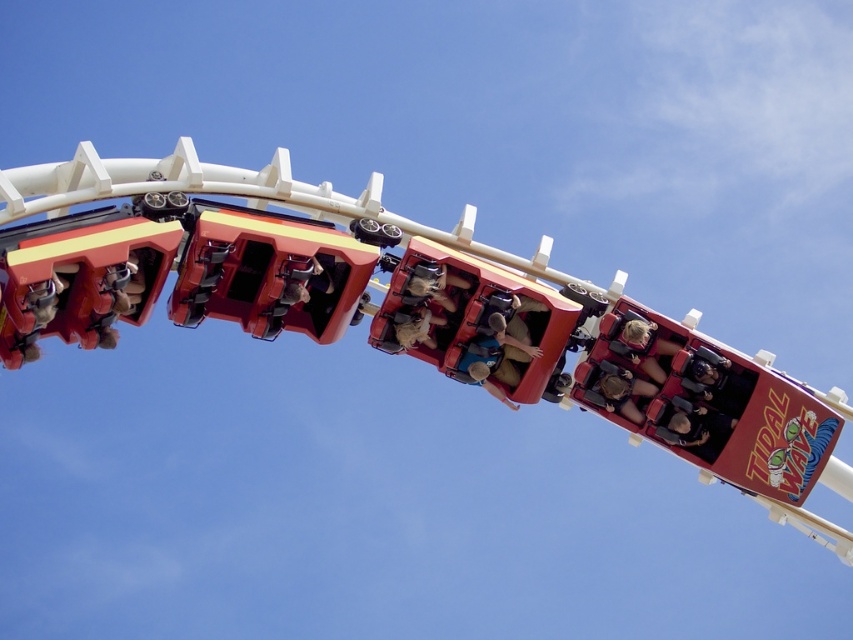
You are a photographer standing at the entrance of the amusement park and want to capture a photo of the matte brown hair at center and the light brown leather helmet at center. Which object should you adjust your camera to focus on first if you want to capture the one that is more to the right?

The matte brown hair at center is positioned on the right side of light brown leather helmet at center, so you should focus on the matte brown hair at center first as it is more to the right.

From the picture: You are a photographer trying to capture the perfect shot of the brown leather jacket at center in the amusement park scene. Based on its position, where should you aim your camera to ensure it is centered in your photo?

To center the brown leather jacket at center in your photo, aim your camera at the coordinates specified by the point 0.536 on the x axis and 0.606 on the y axis, which corresponds to its exact position in the scene.